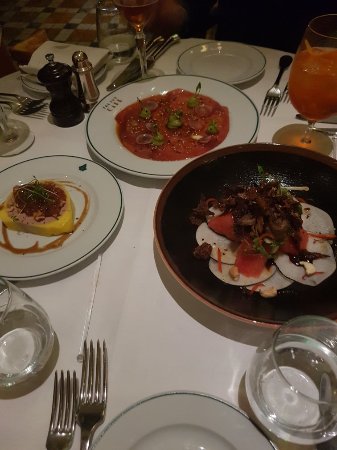
This screenshot has width=337, height=450. What are the coordinates of `pepper grinder` in the screenshot? It's located at (69, 94).